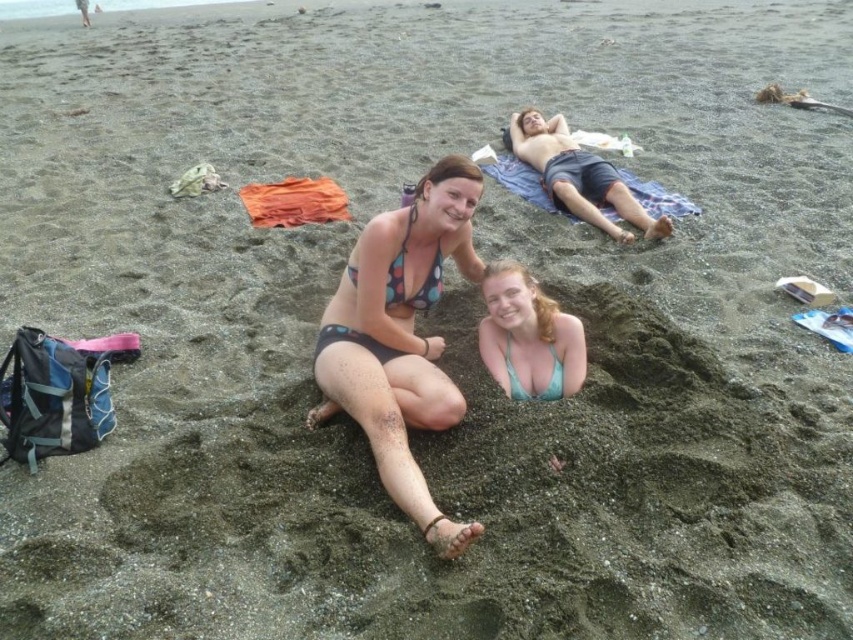
You are standing on the beach and see the polka dot bikini bottom at center. If you want to approach it without stepping on the sand, what is the minimum distance you need to cover?

The minimum distance you need to cover to reach the polka dot bikini bottom at center without stepping on the sand is 2.66 meters.

You are a photographer trying to capture a closeup shot of the polka dot bikini bottom at center and the teal fabric bikini top at center. The camera you are using has a maximum focus range of 40 centimeters. Can you focus on both objects simultaneously?

The polka dot bikini bottom at center and teal fabric bikini top at center are 41.79 centimeters apart from each other. Since the distance between them exceeds the camera maximum focus range of 40 centimeters, the photographer cannot focus on both objects simultaneously.

You are a photographer trying to capture a closeup of the polka dot bikini bottom at center. Based on its coordinates, which are at point 0.528 on the x and 0.470 on the y axis, where should you aim your camera relative to the two women sitting on the sand?

The polka dot bikini bottom at center is located at coordinates 0.528 on the x and 0.470 on the y axis, so you should aim your camera slightly to the right and down relative to the two women sitting on the sand to capture it.